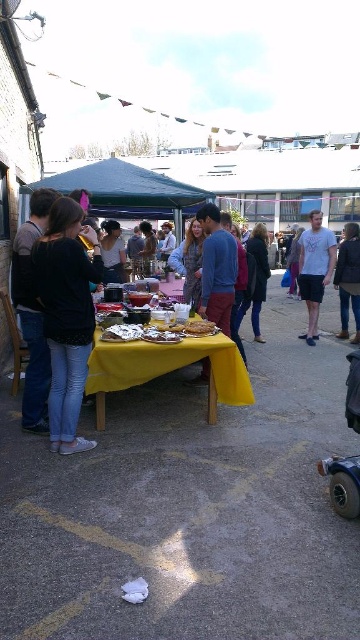
Is blue cotton shirt at center thinner than metallic silver baby carriage at lower right?

Incorrect, blue cotton shirt at center's width is not less than metallic silver baby carriage at lower right's.

Is blue cotton shirt at center to the left of metallic silver baby carriage at lower right from the viewer's perspective?

Yes, blue cotton shirt at center is to the left of metallic silver baby carriage at lower right.

Between point (204, 284) and point (334, 500), which one is positioned behind?

Point (204, 284)

Identify the location of blue cotton shirt at center. (217, 268).

Is point (41, 376) farther from camera compared to point (357, 397)?

Yes, it is behind point (357, 397).

Which is below, dark blue jeans at left or metallic silver baby carriage at lower right?

Positioned lower is metallic silver baby carriage at lower right.

What do you see at coordinates (32, 312) in the screenshot? I see `dark blue jeans at left` at bounding box center [32, 312].

Image resolution: width=360 pixels, height=640 pixels. Find the location of `dark blue jeans at left`. dark blue jeans at left is located at coordinates (32, 312).

Does yellow fabric table at center have a greater height compared to shiny silver tray at center?

Yes, yellow fabric table at center is taller than shiny silver tray at center.

Can you confirm if yellow fabric table at center is smaller than shiny silver tray at center?

No, yellow fabric table at center is not smaller than shiny silver tray at center.

What do you see at coordinates (167, 369) in the screenshot?
I see `yellow fabric table at center` at bounding box center [167, 369].

Locate an element on the screen. The height and width of the screenshot is (640, 360). yellow fabric table at center is located at coordinates (167, 369).